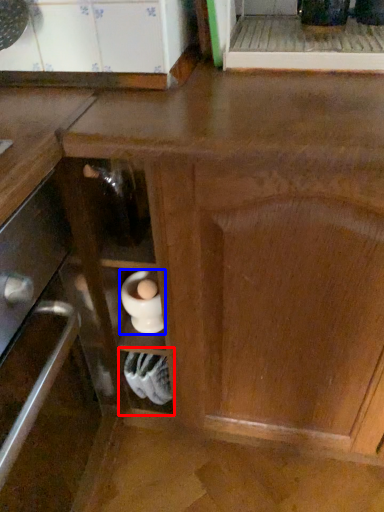
Question: Which point is further to the camera, shelf (highlighted by a red box) or appliance (highlighted by a blue box)?

Choices:
 (A) shelf
 (B) appliance

Answer: (A)